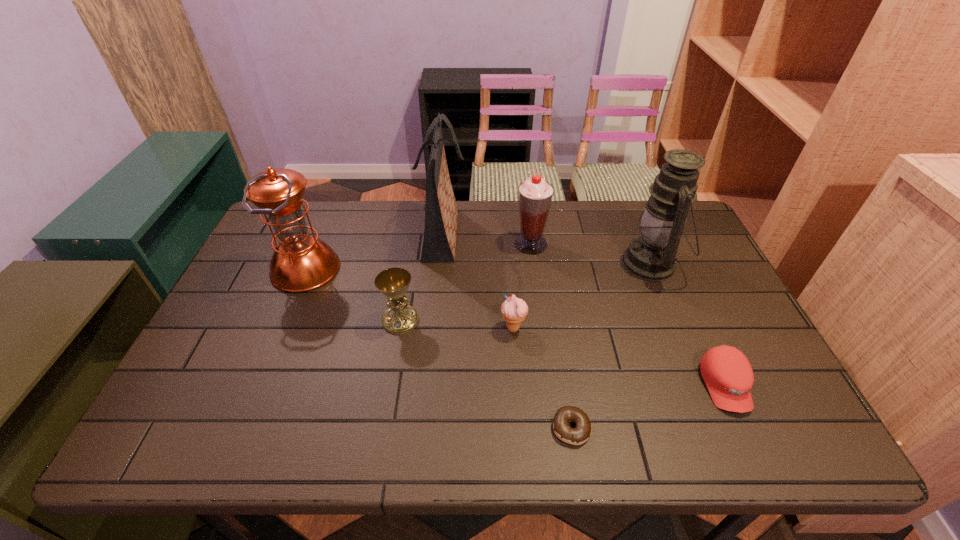
This screenshot has width=960, height=540. I want to click on the fifth closest object to the smoothie, so click(728, 375).

At what (x,y) coordinates should I click in order to perform the action: click on object that can be found as the sixth closest to the right oil lamp. Please return your answer as a coordinate pair (x, y). Looking at the image, I should click on (393, 283).

Locate an element on the screen. vacant space that satisfies the following two spatial constraints: 1. on the front-facing side of the right oil lamp; 2. on the right side of the shopping bag is located at coordinates (440, 264).

You are a GUI agent. You are given a task and a screenshot of the screen. Output one action in this format:
    pyautogui.click(x=<x>, y=<y>)
    Task: Click on the blank space that satisfies the following two spatial constraints: 1. on the front-facing side of the icecream; 2. on the left side of the shopping bag
    This screenshot has width=960, height=540.
    Given the screenshot: What is the action you would take?
    coord(433,328)

Locate an element on the screen. Image resolution: width=960 pixels, height=540 pixels. vacant space that satisfies the following two spatial constraints: 1. on the front-facing side of the sixth tallest object; 2. on the right side of the shopping bag is located at coordinates (433, 328).

At what (x,y) coordinates should I click in order to perform the action: click on free space that satisfies the following two spatial constraints: 1. on the front-facing side of the shopping bag; 2. on the back side of the shortest object. Please return your answer as a coordinate pair (x, y). Looking at the image, I should click on (423, 428).

Identify the location of free space that satisfies the following two spatial constraints: 1. on the front-facing side of the shopping bag; 2. on the right side of the right oil lamp. (440, 264).

Find the location of a particular element. Image resolution: width=960 pixels, height=540 pixels. vacant position in the image that satisfies the following two spatial constraints: 1. on the front side of the fourth tallest object; 2. on the left side of the right oil lamp is located at coordinates (533, 264).